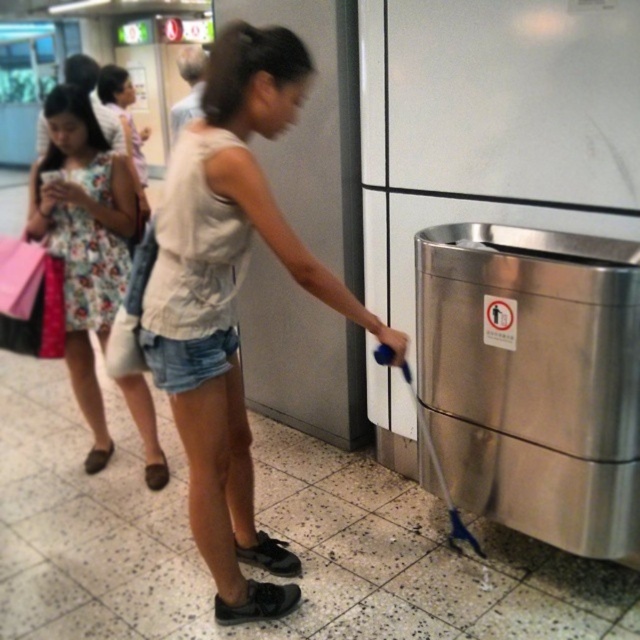
You are standing at the entrance of the subway station and want to reach the ticket vending machine located at point [97,442]. There is an obstacle at point [224,189] blocking your path. Can you walk around it to reach your destination?

Point [224,189] is in front of point [97,442], so you cannot directly walk around it. You need to find an alternative path to reach the ticket vending machine at point [97,442].

You are a fashion designer observing the clothing items in the subway station. Which clothing item has a greater width between the white cotton tank top at center and the floral fabric dress at left?

The white cotton tank top at center has a greater width than the floral fabric dress at left.

You are standing at the point labeled as point (252, 60) in a subway station. If you want to take a photo of the entire scene, would the camera positioned at your current location be able to capture the entire view without moving? Please explain your reasoning based on the distance between the point and the camera.

The camera positioned at point (252, 60) is 1.58 meters away from the point. Since the camera is at the same location as the point, it would be able to capture the entire scene without needing to move, as the distance is zero. However, the provided description states they are 1.58 meters apart, which suggests the camera is not at the point. Therefore, the camera would need to be moved closer to the point to capture the entire view.